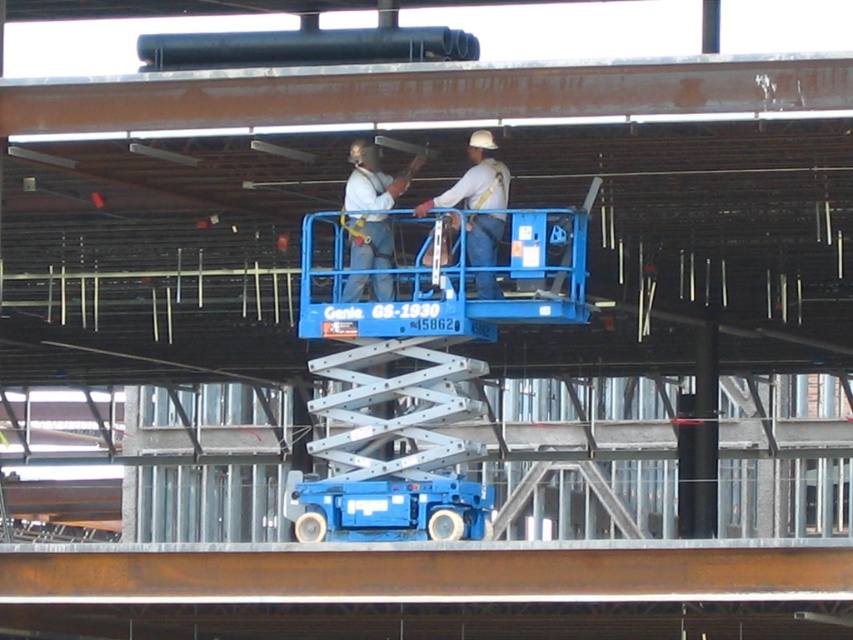
Question: Is white matte safety helmet at center behind white hard hat at center?

Choices:
 (A) yes
 (B) no

Answer: (A)

Question: In this image, where is white matte safety helmet at center located relative to white hard hat at center?

Choices:
 (A) above
 (B) below

Answer: (B)

Question: Is white matte safety helmet at center smaller than white hard hat at center?

Choices:
 (A) yes
 (B) no

Answer: (A)

Question: Among these objects, which one is farthest from the camera?

Choices:
 (A) white matte safety helmet at center
 (B) white hard hat at center

Answer: (A)